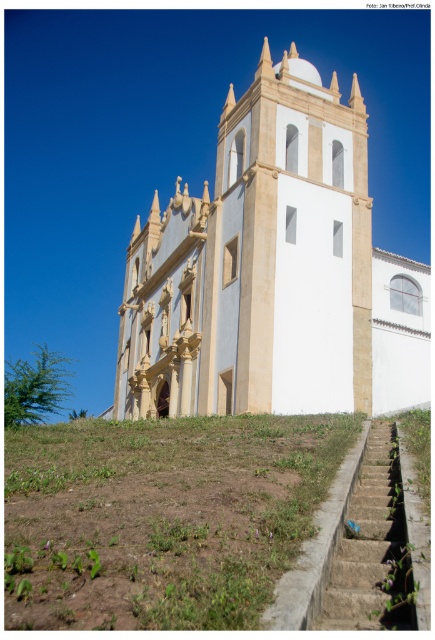
Can you confirm if white smooth church at center is shorter than green grass at lower left?

Incorrect, white smooth church at center's height does not fall short of green grass at lower left's.

Is white smooth church at center further to the viewer compared to green grass at lower left?

That is True.

Who is more forward, (317, 237) or (233, 467)?

Point (233, 467) is in front.

Image resolution: width=435 pixels, height=640 pixels. What are the coordinates of `white smooth church at center` in the screenshot? It's located at (274, 272).

Between point (76, 582) and point (371, 524), which one is positioned behind?

The point (371, 524) is behind.

Can you confirm if green grass at lower left is positioned to the right of concrete stairs at lower right?

No, green grass at lower left is not to the right of concrete stairs at lower right.

Which is behind, point (213, 595) or point (374, 582)?

The point (374, 582) is more distant.

Identify the location of green grass at lower left. The height and width of the screenshot is (640, 435). 160,516.

Can you confirm if white smooth church at center is thinner than concrete stairs at lower right?

No, white smooth church at center is not thinner than concrete stairs at lower right.

Where is `white smooth church at center`? The width and height of the screenshot is (435, 640). white smooth church at center is located at coordinates (274, 272).

At what (x,y) coordinates should I click in order to perform the action: click on white smooth church at center. Please return your answer as a coordinate pair (x, y). Looking at the image, I should click on (274, 272).